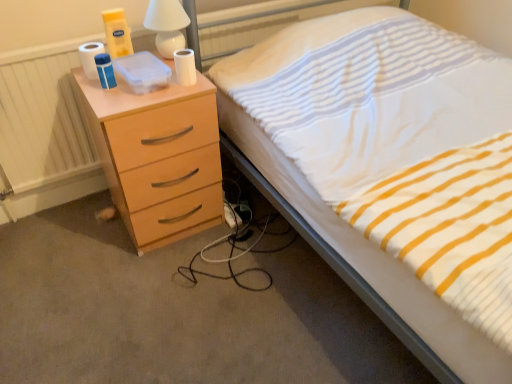
You are a GUI agent. You are given a task and a screenshot of the screen. Output one action in this format:
    pyautogui.click(x=<x>, y=<y>)
    Task: Click on the white fabric extension cord at lower center
    This screenshot has height=384, width=512.
    Given the screenshot: What is the action you would take?
    pyautogui.click(x=231, y=215)

I want to click on white striped fabric at upper right, so click(369, 264).

In order to click on white matte toilet paper at upper center, positioned as the second toilet paper in left-to-right order in this screenshot , I will do `click(185, 67)`.

Does white fabric extension cord at lower center contain matte wood chest of drawers at left?

No, matte wood chest of drawers at left is not surrounded by white fabric extension cord at lower center.

From the image's perspective, does white fabric extension cord at lower center appear lower than matte wood chest of drawers at left?

Yes.

What's the angular difference between white fabric extension cord at lower center and matte wood chest of drawers at left's facing directions?

The angle between the facing direction of white fabric extension cord at lower center and the facing direction of matte wood chest of drawers at left is 0.0606 degrees.

Which of these two, white fabric extension cord at lower center or matte wood chest of drawers at left, stands shorter?

Standing shorter between the two is white fabric extension cord at lower center.

Can you confirm if matte wood chest of drawers at left is wider than white glossy lamp at upper center?

Indeed, matte wood chest of drawers at left has a greater width compared to white glossy lamp at upper center.

From the image's perspective, which one is positioned higher, matte wood chest of drawers at left or white glossy lamp at upper center?

white glossy lamp at upper center appears higher in the image.

Considering the positions of objects matte wood chest of drawers at left and white glossy lamp at upper center in the image provided, who is more to the left, matte wood chest of drawers at left or white glossy lamp at upper center?

Positioned to the left is matte wood chest of drawers at left.

Is white matte toilet paper at upper left, acting as the 2th toilet paper starting from the right, positioned behind white fabric extension cord at lower center?

No, the depth of white matte toilet paper at upper left, acting as the 2th toilet paper starting from the right, is less than that of white fabric extension cord at lower center.

In terms of width, does white matte toilet paper at upper left, marked as the 1th toilet paper in a left-to-right arrangement, look wider or thinner when compared to white fabric extension cord at lower center?

In the image, white matte toilet paper at upper left, marked as the 1th toilet paper in a left-to-right arrangement, appears to be more narrow than white fabric extension cord at lower center.

Is white matte toilet paper at upper left, marked as the 1th toilet paper in a left-to-right arrangement, oriented away from white fabric extension cord at lower center?

No, white matte toilet paper at upper left, marked as the 1th toilet paper in a left-to-right arrangement, is not facing the opposite direction of white fabric extension cord at lower center.

How far apart are white matte toilet paper at upper left, acting as the 2th toilet paper starting from the right, and white fabric extension cord at lower center?

The distance of white matte toilet paper at upper left, acting as the 2th toilet paper starting from the right, from white fabric extension cord at lower center is 30.86 inches.

Is white matte toilet paper at upper center, the 1th toilet paper viewed from the right, inside white fabric extension cord at lower center?

No, white matte toilet paper at upper center, the 1th toilet paper viewed from the right, is not surrounded by white fabric extension cord at lower center.

Is white fabric extension cord at lower center closer to camera compared to white matte toilet paper at upper center, positioned as the second toilet paper in left-to-right order?

No, it is behind white matte toilet paper at upper center, positioned as the second toilet paper in left-to-right order.

How different are the orientations of white fabric extension cord at lower center and white matte toilet paper at upper center, the 1th toilet paper viewed from the right, in degrees?

There is a 0.0589-degree angle between the facing directions of white fabric extension cord at lower center and white matte toilet paper at upper center, the 1th toilet paper viewed from the right.

Is white fabric extension cord at lower center touching white matte toilet paper at upper center, the 1th toilet paper viewed from the right?

No, white fabric extension cord at lower center is not with white matte toilet paper at upper center, the 1th toilet paper viewed from the right.

Looking at this image, considering the relative sizes of white matte toilet paper at upper left, marked as the 1th toilet paper in a left-to-right arrangement, and white matte toilet paper at upper center, positioned as the second toilet paper in left-to-right order, in the image provided, is white matte toilet paper at upper left, marked as the 1th toilet paper in a left-to-right arrangement, bigger than white matte toilet paper at upper center, positioned as the second toilet paper in left-to-right order,?

Indeed, white matte toilet paper at upper left, marked as the 1th toilet paper in a left-to-right arrangement, has a larger size compared to white matte toilet paper at upper center, positioned as the second toilet paper in left-to-right order.

Does white matte toilet paper at upper left, acting as the 2th toilet paper starting from the right, have a lesser height compared to white matte toilet paper at upper center, positioned as the second toilet paper in left-to-right order?

In fact, white matte toilet paper at upper left, acting as the 2th toilet paper starting from the right, may be taller than white matte toilet paper at upper center, positioned as the second toilet paper in left-to-right order.

Is white matte toilet paper at upper left, acting as the 2th toilet paper starting from the right, in contact with white matte toilet paper at upper center, positioned as the second toilet paper in left-to-right order?

No, white matte toilet paper at upper left, acting as the 2th toilet paper starting from the right, is not beside white matte toilet paper at upper center, positioned as the second toilet paper in left-to-right order.

From a real-world perspective, does white matte toilet paper at upper left, marked as the 1th toilet paper in a left-to-right arrangement, sit lower than white matte toilet paper at upper center, positioned as the second toilet paper in left-to-right order?

No, from a real-world perspective, white matte toilet paper at upper left, marked as the 1th toilet paper in a left-to-right arrangement, is not beneath white matte toilet paper at upper center, positioned as the second toilet paper in left-to-right order.

Between white matte toilet paper at upper left, marked as the 1th toilet paper in a left-to-right arrangement, and matte wood chest of drawers at left, which one is positioned in front?

matte wood chest of drawers at left is more forward.

Does white matte toilet paper at upper left, acting as the 2th toilet paper starting from the right, have a smaller size compared to matte wood chest of drawers at left?

Correct, white matte toilet paper at upper left, acting as the 2th toilet paper starting from the right, occupies less space than matte wood chest of drawers at left.

Consider the image. Could you tell me if white matte toilet paper at upper left, marked as the 1th toilet paper in a left-to-right arrangement, is facing matte wood chest of drawers at left?

No.

From a real-world perspective, who is located higher, white matte toilet paper at upper left, acting as the 2th toilet paper starting from the right, or matte wood chest of drawers at left?

white matte toilet paper at upper left, acting as the 2th toilet paper starting from the right, from a real-world perspective.

This screenshot has width=512, height=384. What are the coordinates of `bed lying on the right of white glossy lamp at upper center` in the screenshot? It's located at (369, 264).

Is white striped fabric at upper right placed right next to white glossy lamp at upper center?

white striped fabric at upper right and white glossy lamp at upper center are not in contact.

Looking at this image, how many degrees apart are the facing directions of white striped fabric at upper right and white glossy lamp at upper center?

The facing directions of white striped fabric at upper right and white glossy lamp at upper center are 0.411 degrees apart.

Does white striped fabric at upper right come behind white glossy lamp at upper center?

No, white striped fabric at upper right is closer to the camera.

The height and width of the screenshot is (384, 512). Identify the location of chest of drawers lying on the left of white fabric extension cord at lower center. (158, 157).

Locate an element on the screen. The image size is (512, 384). bedside lamp that is above the matte wood chest of drawers at left (from the image's perspective) is located at coordinates (167, 25).

Consider the image. When comparing their distances from matte wood chest of drawers at left, does white matte toilet paper at upper center, positioned as the second toilet paper in left-to-right order, or white matte toilet paper at upper left, marked as the 1th toilet paper in a left-to-right arrangement, seem closer?

white matte toilet paper at upper center, positioned as the second toilet paper in left-to-right order, lies closer to matte wood chest of drawers at left than the other object.

Considering their positions, is white striped fabric at upper right positioned closer to white fabric extension cord at lower center than white glossy lamp at upper center?

Among the two, white striped fabric at upper right is located nearer to white fabric extension cord at lower center.

Looking at the image, which one is located closer to white matte toilet paper at upper center, positioned as the second toilet paper in left-to-right order, white glossy lamp at upper center or matte wood chest of drawers at left?

white glossy lamp at upper center lies closer to white matte toilet paper at upper center, positioned as the second toilet paper in left-to-right order, than the other object.

Estimate the real-world distances between objects in this image. Which object is further from white matte toilet paper at upper center, positioned as the second toilet paper in left-to-right order, white glossy lamp at upper center or white fabric extension cord at lower center?

white fabric extension cord at lower center lies further to white matte toilet paper at upper center, positioned as the second toilet paper in left-to-right order, than the other object.

When comparing their distances from white fabric extension cord at lower center, does white glossy lamp at upper center or matte wood chest of drawers at left seem further?

Based on the image, white glossy lamp at upper center appears to be further to white fabric extension cord at lower center.

Which object lies nearer to the anchor point white fabric extension cord at lower center, white matte toilet paper at upper left, acting as the 2th toilet paper starting from the right, or white striped fabric at upper right?

white striped fabric at upper right lies closer to white fabric extension cord at lower center than the other object.

From the image, which object appears to be nearer to matte wood chest of drawers at left, white glossy lamp at upper center or white striped fabric at upper right?

white striped fabric at upper right lies closer to matte wood chest of drawers at left than the other object.

When comparing their distances from white matte toilet paper at upper center, the 1th toilet paper viewed from the right, does matte wood chest of drawers at left or white fabric extension cord at lower center seem further?

white fabric extension cord at lower center lies further to white matte toilet paper at upper center, the 1th toilet paper viewed from the right, than the other object.

Identify the location of toilet paper located between white matte toilet paper at upper left, marked as the 1th toilet paper in a left-to-right arrangement, and white striped fabric at upper right in the left-right direction. (185, 67).

Find the location of a particular element. toilet paper located between white glossy lamp at upper center and white striped fabric at upper right in the left-right direction is located at coordinates (185, 67).

Locate an element on the screen. toilet paper between white matte toilet paper at upper left, marked as the 1th toilet paper in a left-to-right arrangement, and matte wood chest of drawers at left in the up-down direction is located at coordinates (185, 67).

At what (x,y) coordinates should I click in order to perform the action: click on toilet paper between white matte toilet paper at upper left, marked as the 1th toilet paper in a left-to-right arrangement, and white fabric extension cord at lower center in the up-down direction. Please return your answer as a coordinate pair (x, y). This screenshot has height=384, width=512. Looking at the image, I should click on (185, 67).